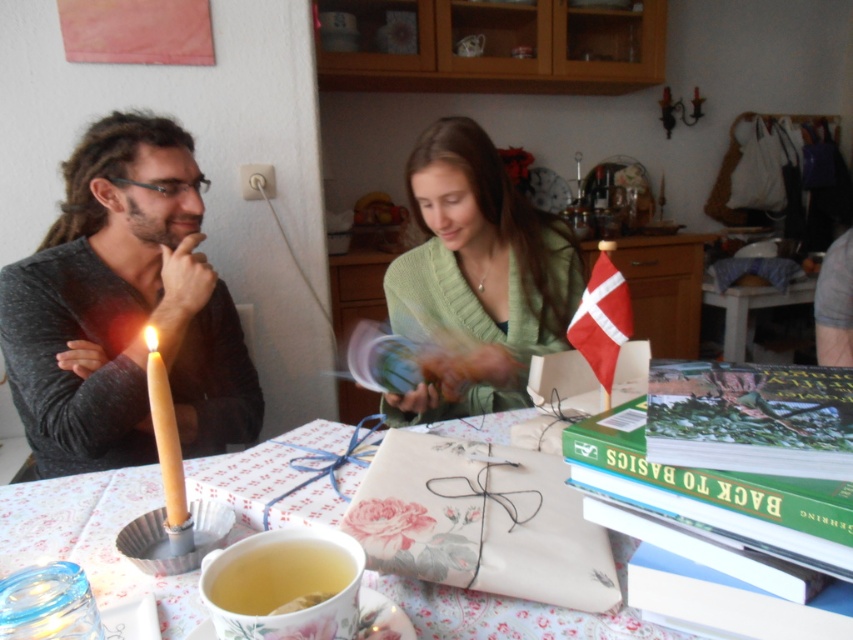
Question: From the image, what is the correct spatial relationship of gray matte shirt at left in relation to green matte sweater at center?

Choices:
 (A) right
 (B) left

Answer: (B)

Question: Does gray matte shirt at left have a greater width compared to floral paper wrapped gift at center?

Choices:
 (A) yes
 (B) no

Answer: (B)

Question: Which of these objects is positioned farthest from the matte black shirt at left?

Choices:
 (A) floral paper wrapped gift at center
 (B) yellow wax candle at left

Answer: (B)

Question: Which of these objects is positioned farthest from the gray matte shirt at left?

Choices:
 (A) floral paper wrapped gift at center
 (B) green matte sweater at center

Answer: (A)

Question: Which point is farther to the camera?

Choices:
 (A) (16, 512)
 (B) (96, 292)
 (C) (173, 461)
 (D) (308, 572)

Answer: (B)

Question: Is the position of translucent ceramic cup at lower center more distant than that of yellow wax candle at left?

Choices:
 (A) yes
 (B) no

Answer: (B)